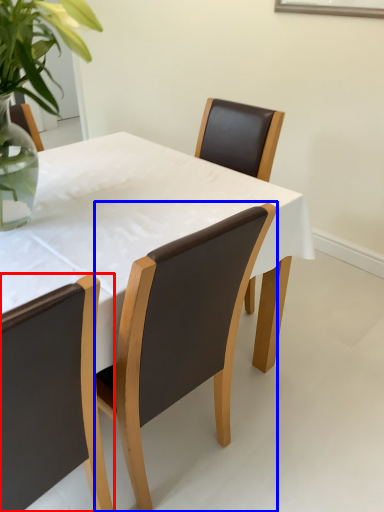
Question: Which object appears farthest to the camera in this image, chair (highlighted by a red box) or chair (highlighted by a blue box)?

Choices:
 (A) chair
 (B) chair

Answer: (B)